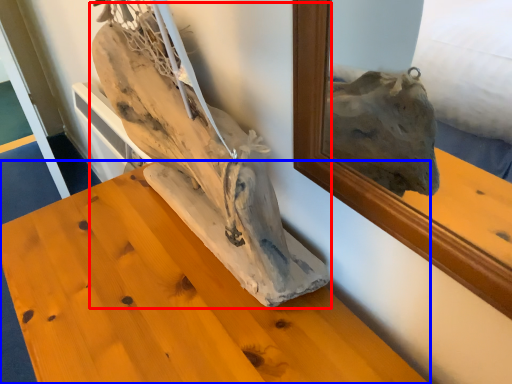
Question: Which object appears farthest to the camera in this image, sculpture (highlighted by a red box) or furniture (highlighted by a blue box)?

Choices:
 (A) sculpture
 (B) furniture

Answer: (B)